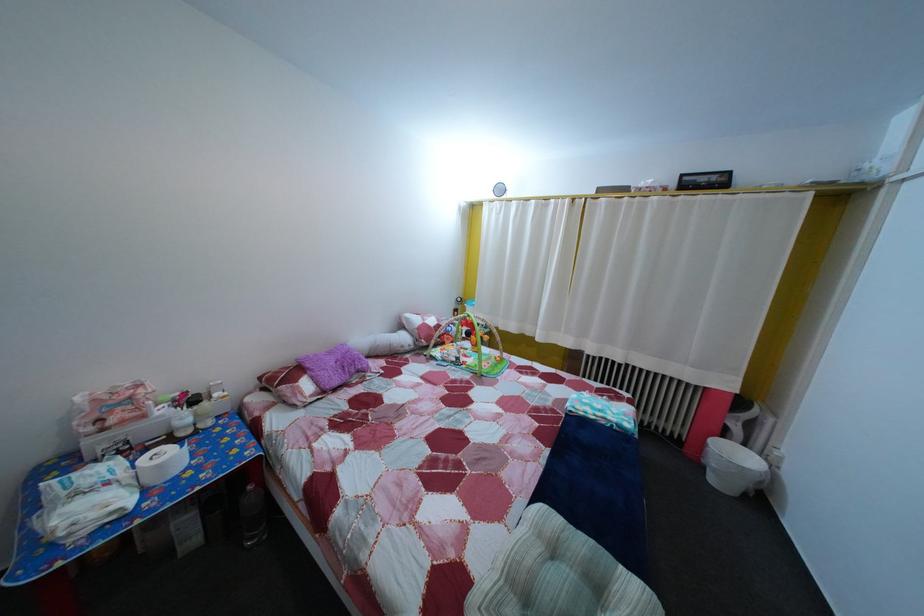
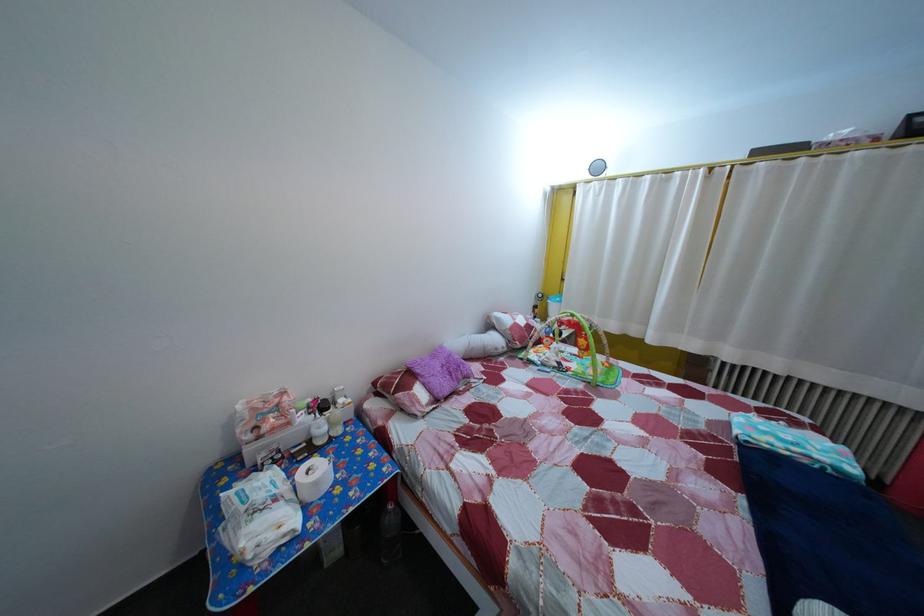
Where in the second image is the point corresponding to the point at 153,424 from the first image?

(298, 432)